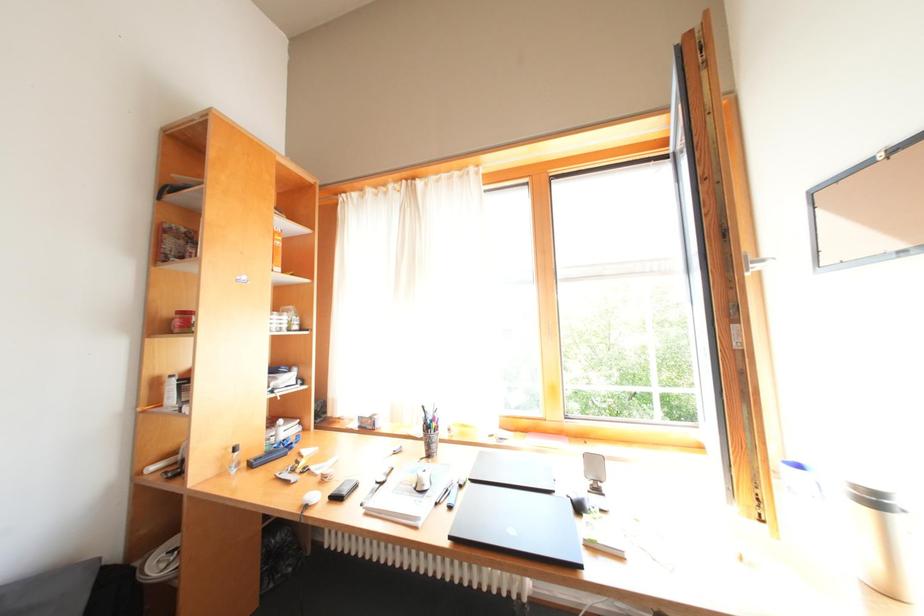
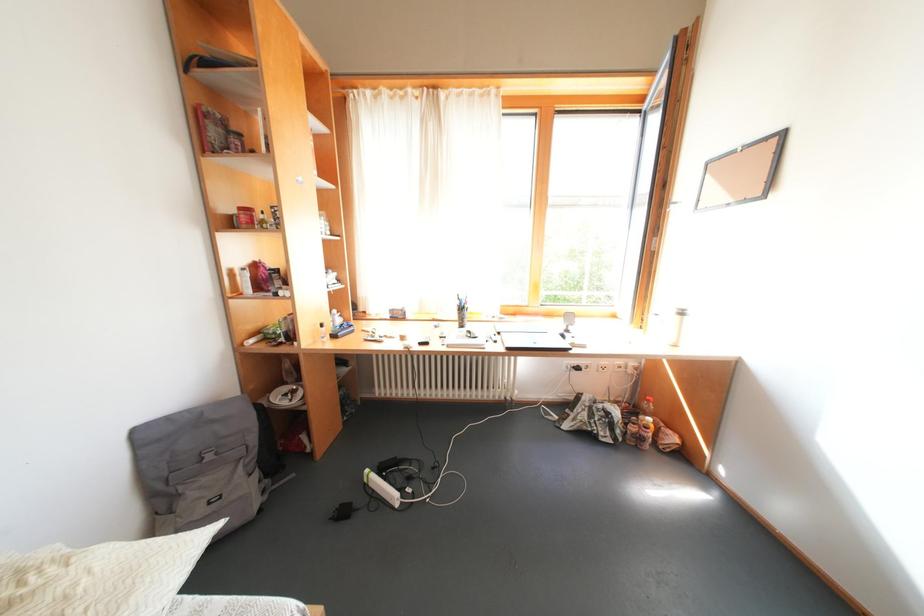
The images are taken continuously from a first-person perspective. In which direction are you moving?

The cameraman moved toward left, backward.